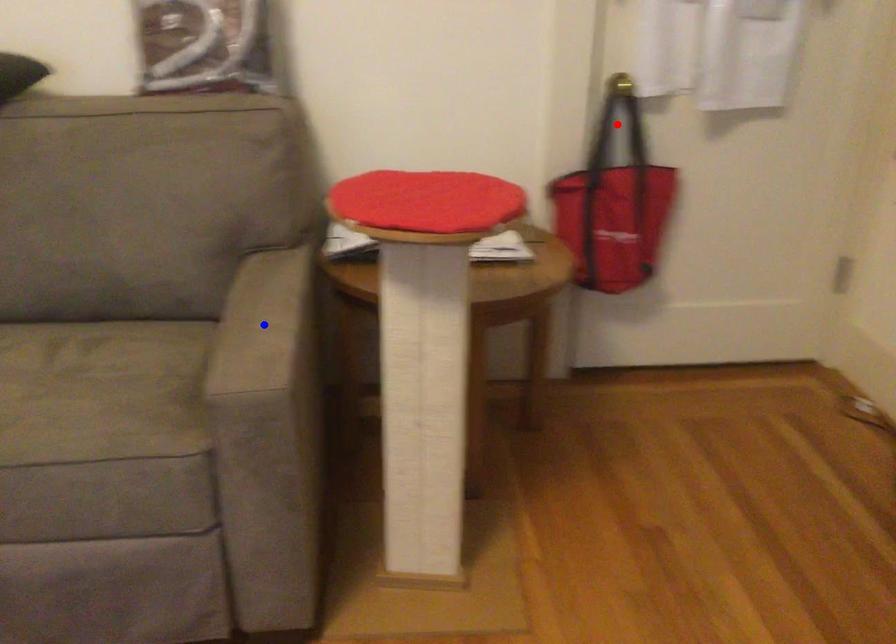
Question: Two points are marked on the image. Which point is closer to the camera?

Choices:
 (A) Blue point is closer.
 (B) Red point is closer.

Answer: (A)